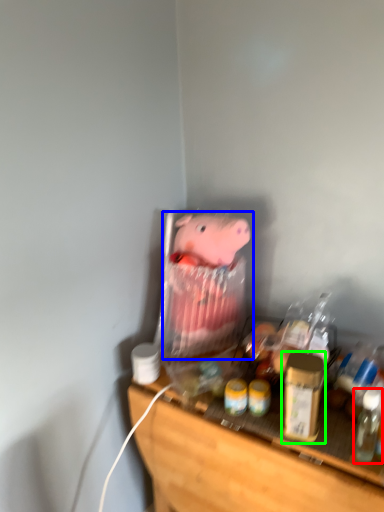
Question: Based on their relative distances, which object is nearer to bottle (highlighted by a red box)? Choose from toy (highlighted by a blue box) and beverage (highlighted by a green box).

Choices:
 (A) toy
 (B) beverage

Answer: (B)